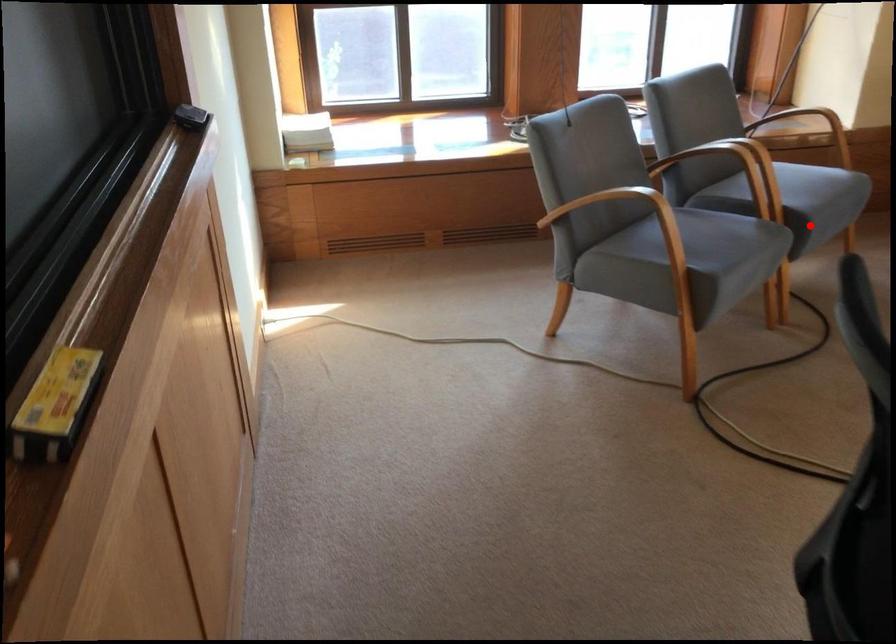
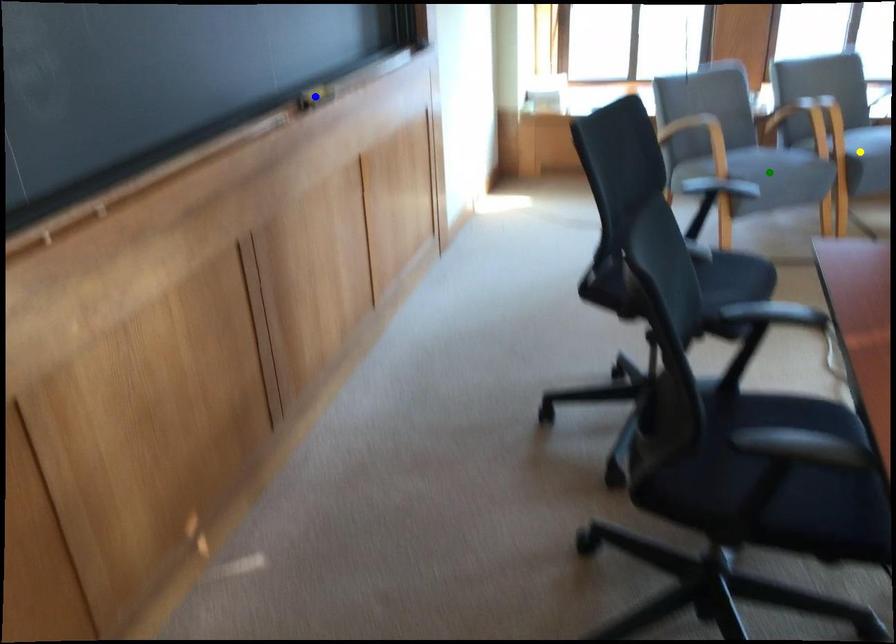
Question: I am providing you with two images of the same scene from different viewpoints. A red point is marked on the first image. You are given multiple points on the second image. Which point in image 2 is actually the same real-world point as the red point in image 1?

Choices:
 (A) yellow point
 (B) green point
 (C) blue point

Answer: (A)